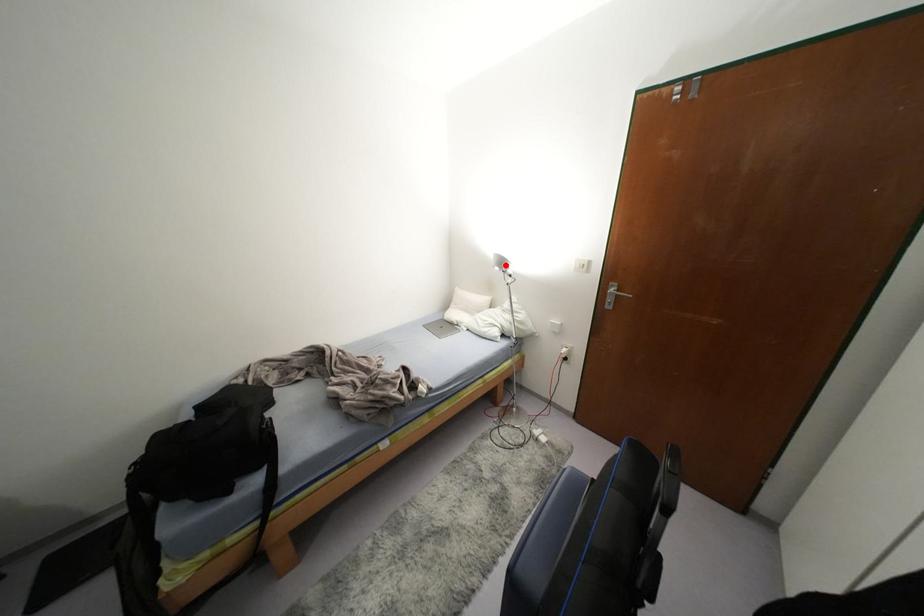
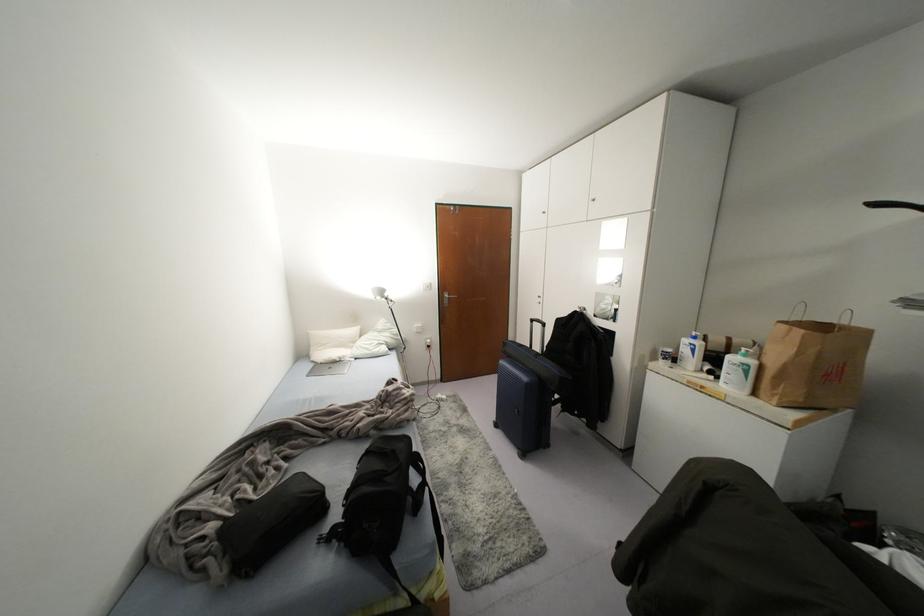
The point at the highlighted location is marked in the first image. Where is the corresponding point in the second image?

(385, 294)